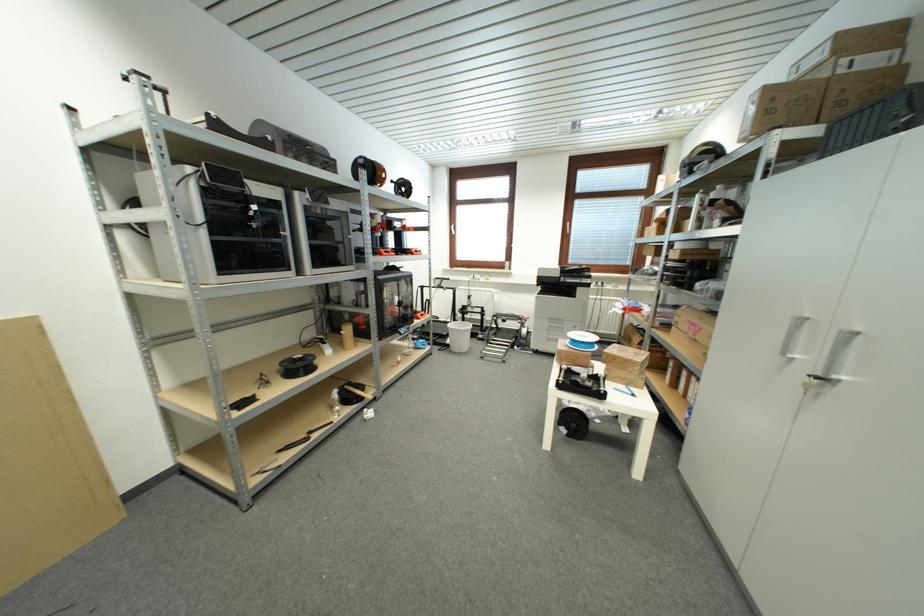
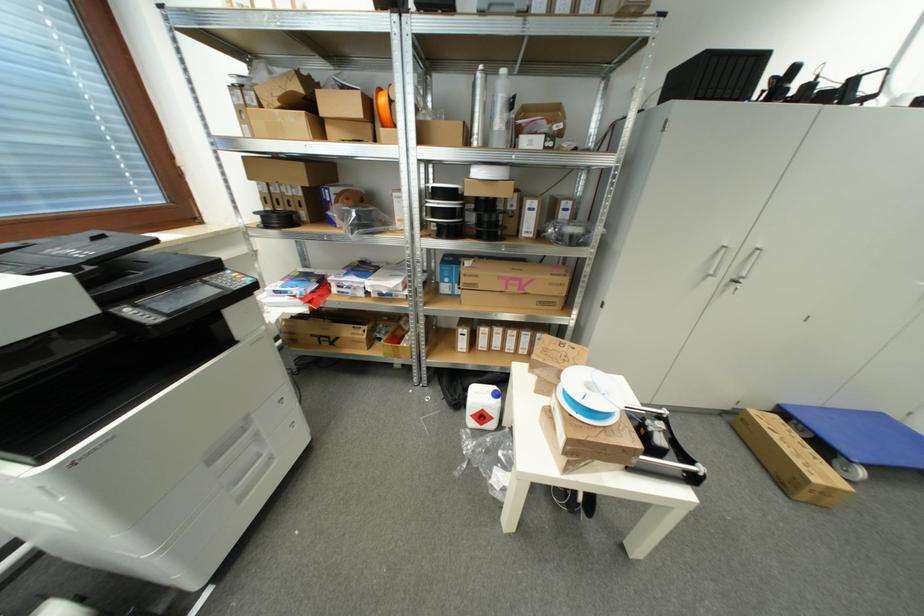
Where in the second image is the point corresponding to point (590, 339) from the first image?

(594, 387)